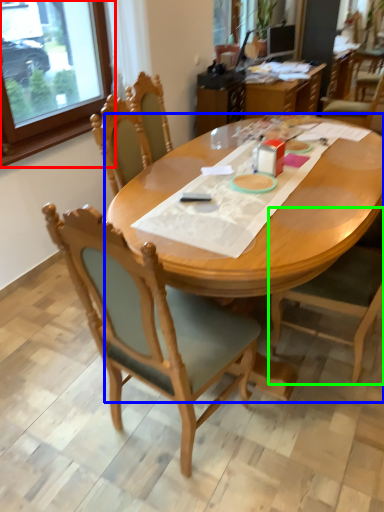
Question: Which is farther away from window frame (highlighted by a red box)? desk (highlighted by a blue box) or chair (highlighted by a green box)?

Choices:
 (A) desk
 (B) chair

Answer: (B)